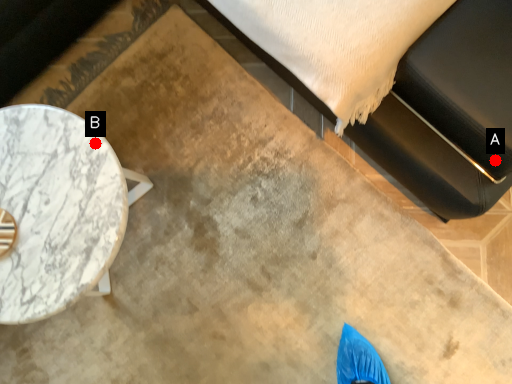
Question: Two points are circled on the image, labeled by A and B beside each circle. Which point is closer to the camera?

Choices:
 (A) A is closer
 (B) B is closer

Answer: (A)